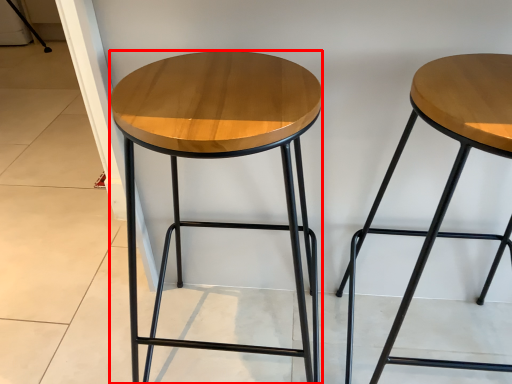
Question: From the image's perspective, what is the correct spatial positioning of stool (annotated by the red box) in reference to stool?

Choices:
 (A) below
 (B) above

Answer: (B)